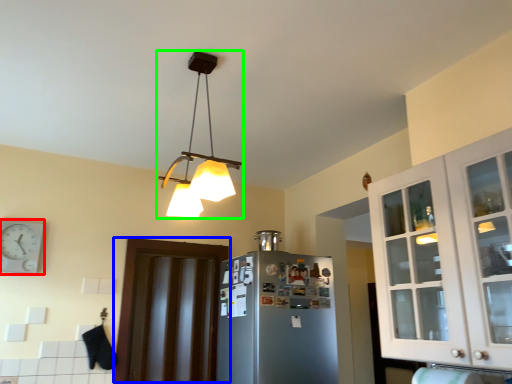
Question: Estimate the real-world distances between objects in this image. Which object is farther from clock (highlighted by a red box), door (highlighted by a blue box) or lamp (highlighted by a green box)?

Choices:
 (A) door
 (B) lamp

Answer: (B)